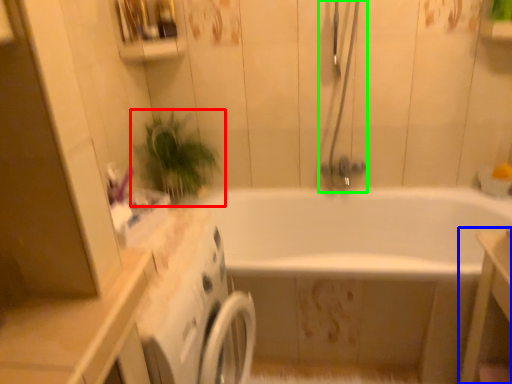
Question: Which is nearer to the houseplant (highlighted by a red box)? vanity (highlighted by a blue box) or shower door (highlighted by a green box).

Choices:
 (A) vanity
 (B) shower door

Answer: (B)